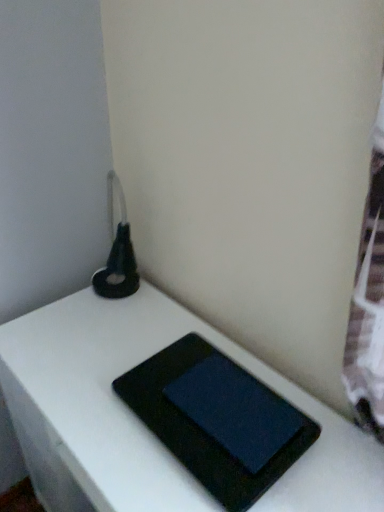
Question: Considering their positions, is black matte tablet at center, placed as the 1th tablet computer when sorted from bottom to top, located in front of or behind matte black tablet at center, acting as the 2th tablet computer starting from the bottom?

Choices:
 (A) front
 (B) behind

Answer: (A)

Question: Is black matte tablet at center, the 2th tablet computer in the top-to-bottom sequence, wider or thinner than matte black tablet at center, acting as the 2th tablet computer starting from the bottom?

Choices:
 (A) thin
 (B) wide

Answer: (B)

Question: Based on their relative distances, which object is nearer to the matte black tablet at center, which ranks as the 1th tablet computer in top-to-bottom order?

Choices:
 (A) black matte book at center
 (B) black matte tablet at center, placed as the 1th tablet computer when sorted from bottom to top

Answer: (B)

Question: Estimate the real-world distances between objects in this image. Which object is farther from the black matte book at center?

Choices:
 (A) black matte tablet at center, the 2th tablet computer in the top-to-bottom sequence
 (B) matte black tablet at center, which ranks as the 1th tablet computer in top-to-bottom order

Answer: (B)